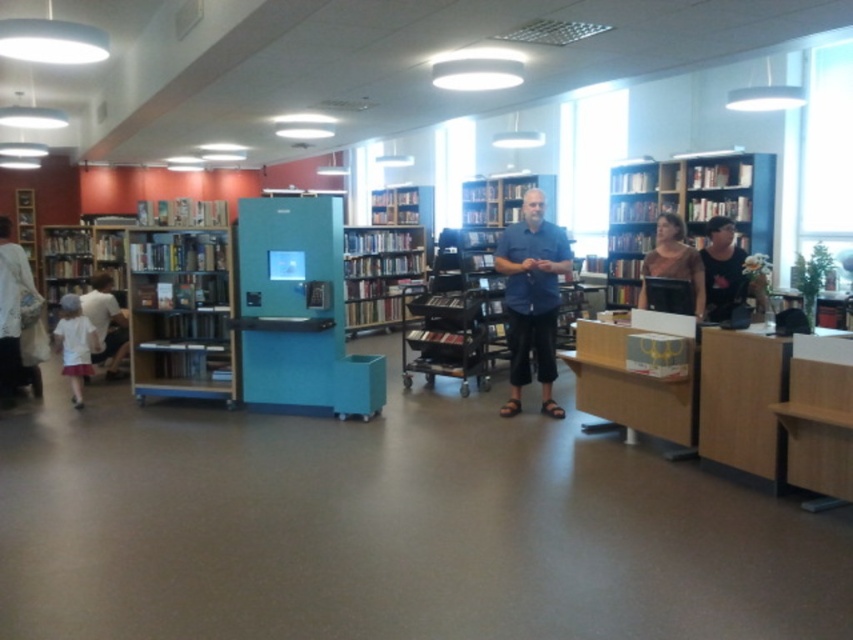
Question: Which point is closer to the camera?

Choices:
 (A) (672, 173)
 (B) (7, 381)
 (C) (15, 198)
 (D) (71, 310)

Answer: (B)

Question: Where is wooden bookcase at right located in relation to white cotton dress at left in the image?

Choices:
 (A) below
 (B) above

Answer: (B)

Question: Which object appears farthest from the camera in this image?

Choices:
 (A) wooden bookshelf at left
 (B) white cotton shirt at left
 (C) wooden bookshelf at center
 (D) matte pink shirt at center

Answer: (A)

Question: Which point is farther from the camera taking this photo?

Choices:
 (A) (554, 404)
 (B) (77, 300)
 (C) (683, 192)
 (D) (33, 250)

Answer: (D)

Question: Is black tank top at right closer to the viewer compared to wooden bookshelf at left?

Choices:
 (A) yes
 (B) no

Answer: (A)

Question: Does wooden bookcase at right have a greater width compared to white cotton dress at left?

Choices:
 (A) no
 (B) yes

Answer: (B)